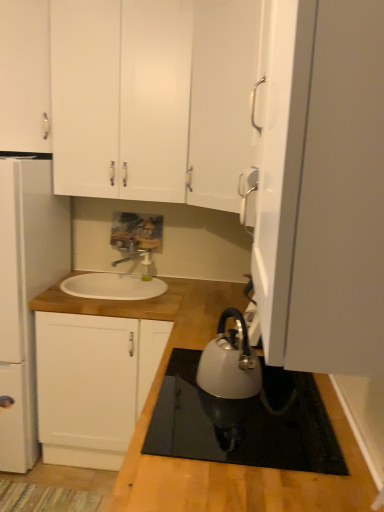
I want to click on vacant area located to the right-hand side of satin silver kettle at lower center, so click(291, 396).